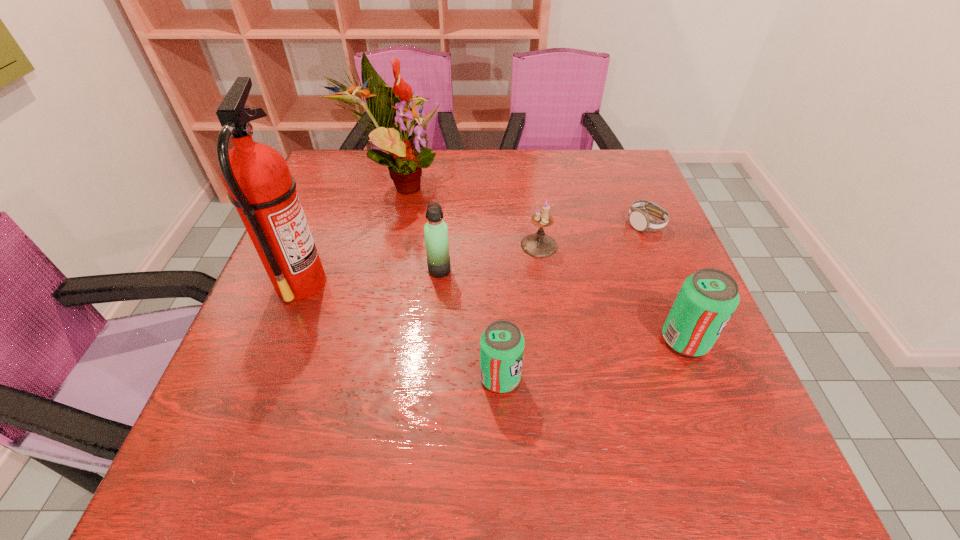
You are a GUI agent. You are given a task and a screenshot of the screen. Output one action in this format:
    pyautogui.click(x=<x>, y=<y>)
    Task: Click on the vacant space in between the thermos bottle and the bouquet
    Image resolution: width=960 pixels, height=540 pixels.
    Given the screenshot: What is the action you would take?
    pyautogui.click(x=418, y=227)

I want to click on free space between the second tallest object and the left pop soda, so click(448, 280).

Where is `free space that is in between the watch and the right pop soda`? This screenshot has width=960, height=540. free space that is in between the watch and the right pop soda is located at coordinates (665, 282).

Identify the location of vacant area that lies between the taller pop soda and the fire extinguisher. This screenshot has height=540, width=960. (493, 311).

I want to click on vacant area that lies between the thermos bottle and the left pop soda, so click(470, 324).

The width and height of the screenshot is (960, 540). What are the coordinates of `free space between the tallest object and the watch` in the screenshot? It's located at (473, 253).

In order to click on free spot between the fourth object from left to right and the second tallest object in this screenshot , I will do `click(448, 280)`.

The width and height of the screenshot is (960, 540). In order to click on the closest object to the thermos bottle in this screenshot , I will do `click(539, 245)`.

At what (x,y) coordinates should I click in order to perform the action: click on object identified as the second closest to the thermos bottle. Please return your answer as a coordinate pair (x, y). Image resolution: width=960 pixels, height=540 pixels. Looking at the image, I should click on (388, 107).

In order to click on vacant space that satisfies the following two spatial constraints: 1. on the front-facing side of the farthest object; 2. on the right side of the thermos bottle in this screenshot , I will do `click(375, 270)`.